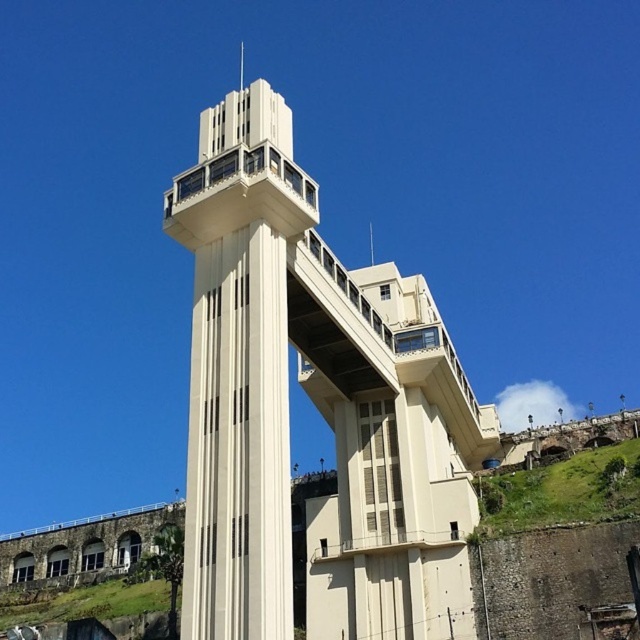
You are standing at the base of the tower and want to reach the point marked at coordinates point (212, 172). If your walking speed is 3 feet per second, how many seconds will it take you to reach that point?

The distance of point (212, 172) from viewer is 133.88 feet. At a speed of 3 feet per second, it would take approximately 44.6 seconds to reach the point.

Based on the scene description, which tower is positioned to the left when observing the beige concrete tower at center and the white smooth tower at center?

The white smooth tower at center is positioned to the left of the beige concrete tower at center.